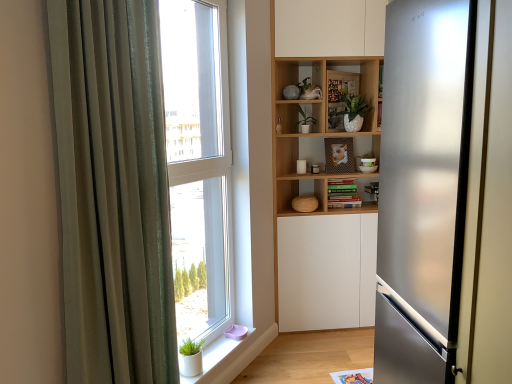
Question: Is satin silver refrigerator at right at the right side of green matte plant at center, the second plant in the right-to-left sequence?

Choices:
 (A) no
 (B) yes

Answer: (B)

Question: Would you say green matte plant at center, the second plant in the right-to-left sequence, is part of satin silver refrigerator at right's contents?

Choices:
 (A) no
 (B) yes

Answer: (A)

Question: From the image's perspective, is satin silver refrigerator at right on green matte plant at center, which is the first plant from left to right?

Choices:
 (A) yes
 (B) no

Answer: (B)

Question: From a real-world perspective, is satin silver refrigerator at right positioned under green matte plant at center, which is the first plant from left to right, based on gravity?

Choices:
 (A) yes
 (B) no

Answer: (A)

Question: Is satin silver refrigerator at right with green matte plant at center, the second plant in the right-to-left sequence?

Choices:
 (A) no
 (B) yes

Answer: (A)

Question: From a real-world perspective, relative to transparent glass window at center, is green matte plant at upper center, marked as the second plant in a left-to-right arrangement, vertically above or below?

Choices:
 (A) below
 (B) above

Answer: (B)

Question: From the image's perspective, is green matte plant at upper center, marked as the second plant in a left-to-right arrangement, above or below transparent glass window at center?

Choices:
 (A) above
 (B) below

Answer: (A)

Question: Is green matte plant at upper center, the 1th plant from the right, inside or outside of transparent glass window at center?

Choices:
 (A) outside
 (B) inside

Answer: (A)

Question: Considering their positions, is green matte plant at upper center, the 1th plant from the right, located in front of or behind transparent glass window at center?

Choices:
 (A) front
 (B) behind

Answer: (B)

Question: Does point (360, 107) appear closer or farther from the camera than point (297, 120)?

Choices:
 (A) farther
 (B) closer

Answer: (A)

Question: From their relative heights in the image, would you say green matte plant at upper center, marked as the second plant in a left-to-right arrangement, is taller or shorter than green matte plant at center, the second plant in the right-to-left sequence?

Choices:
 (A) short
 (B) tall

Answer: (B)

Question: From the image's perspective, is green matte plant at upper center, marked as the second plant in a left-to-right arrangement, positioned above or below green matte plant at center, the second plant in the right-to-left sequence?

Choices:
 (A) above
 (B) below

Answer: (A)

Question: Which is correct: green matte plant at upper center, marked as the second plant in a left-to-right arrangement, is inside green matte plant at center, the second plant in the right-to-left sequence, or outside of it?

Choices:
 (A) inside
 (B) outside

Answer: (B)

Question: From the image's perspective, is satin silver refrigerator at right above or below wooden bookshelf at center?

Choices:
 (A) below
 (B) above

Answer: (A)

Question: Considering the positions of point (377, 213) and point (326, 57), is point (377, 213) closer or farther from the camera than point (326, 57)?

Choices:
 (A) farther
 (B) closer

Answer: (A)